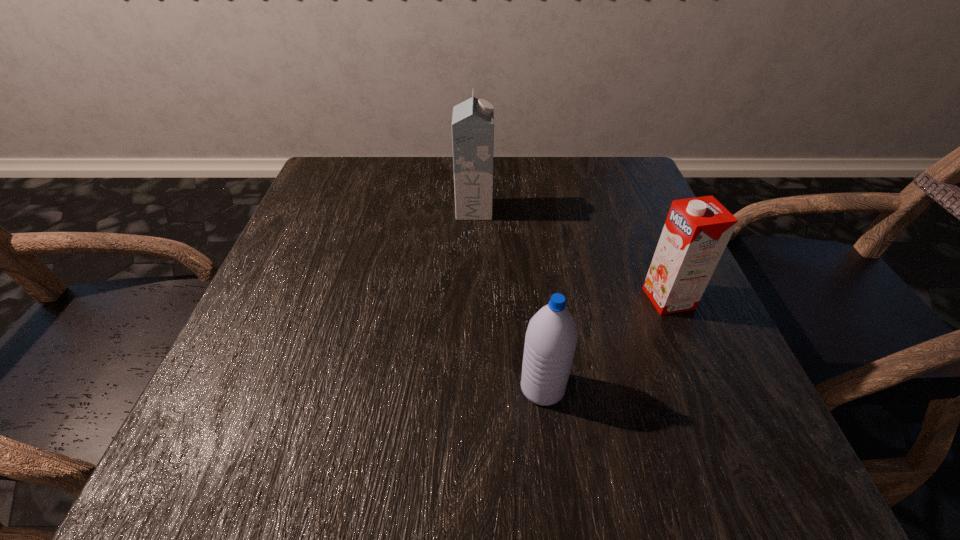
Find the location of a particular element. vacant point that satisfies the following two spatial constraints: 1. on the front label of the taller carton; 2. on the left side of the nearer carton is located at coordinates (472, 298).

Where is `vacant point that satisfies the following two spatial constraints: 1. on the front label of the taller carton; 2. on the back side of the nearest object`? The height and width of the screenshot is (540, 960). vacant point that satisfies the following two spatial constraints: 1. on the front label of the taller carton; 2. on the back side of the nearest object is located at coordinates (471, 388).

Where is `vacant space that satisfies the following two spatial constraints: 1. on the front label of the taller carton; 2. on the back side of the second object from right to left`? This screenshot has height=540, width=960. vacant space that satisfies the following two spatial constraints: 1. on the front label of the taller carton; 2. on the back side of the second object from right to left is located at coordinates (471, 388).

Locate an element on the screen. The width and height of the screenshot is (960, 540). blank area in the image that satisfies the following two spatial constraints: 1. on the front label of the farther carton; 2. on the left side of the second object from left to right is located at coordinates (471, 388).

What are the coordinates of `vacant area in the image that satisfies the following two spatial constraints: 1. on the front label of the second object from left to right; 2. on the left side of the tallest object` in the screenshot? It's located at (471, 388).

Find the location of a particular element. This screenshot has height=540, width=960. vacant region that satisfies the following two spatial constraints: 1. on the front label of the left carton; 2. on the right side of the nearest object is located at coordinates (471, 388).

Where is `free space that satisfies the following two spatial constraints: 1. on the front label of the leftmost object; 2. on the back side of the water bottle`? The width and height of the screenshot is (960, 540). free space that satisfies the following two spatial constraints: 1. on the front label of the leftmost object; 2. on the back side of the water bottle is located at coordinates (471, 388).

At what (x,y) coordinates should I click in order to perform the action: click on vacant space that satisfies the following two spatial constraints: 1. on the front label of the left carton; 2. on the back side of the second object from right to left. Please return your answer as a coordinate pair (x, y). The image size is (960, 540). Looking at the image, I should click on (471, 388).

I want to click on free location that satisfies the following two spatial constraints: 1. on the front label of the farthest object; 2. on the left side of the nearest object, so point(471,388).

Image resolution: width=960 pixels, height=540 pixels. Find the location of `vacant point that satisfies the following two spatial constraints: 1. on the front label of the leftmost object; 2. on the right side of the second nearest object`. vacant point that satisfies the following two spatial constraints: 1. on the front label of the leftmost object; 2. on the right side of the second nearest object is located at coordinates (472, 298).